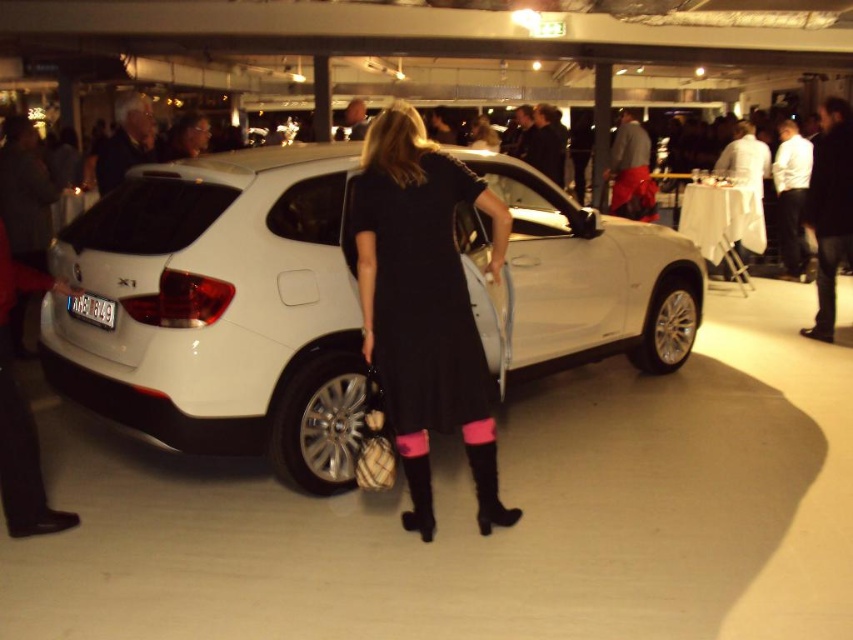
You are at the car exhibition and want to find the white metallic car at center. According to the coordinates provided, where should you look to locate it?

The white metallic car at center is located at point coordinates [219,308].

Looking at this image, you are a photographer standing in front of the white metallic car at center at a car exhibition. You want to take a photo of the car from a distance that allows you to capture the entire vehicle in the frame without any cropping. Considering the average height of a car is about 1.5 meters, what is the minimum distance you should maintain from the car to ensure it fits perfectly in your camera frame?

The minimum distance you should maintain from the white metallic car at center is 3.17 meters to ensure the entire vehicle fits in the frame without cropping, as this distance allows the camera to capture the car at its full height of approximately 1.5 meters.

You are standing at the position of point (390, 365) and want to move to the location of point (294, 154). Based on the scene, which direction should you move to reach your destination?

To move from point (390, 365) to point (294, 154), you should move in a direction that is behind the current position since point (294, 154) is located behind point (390, 365).